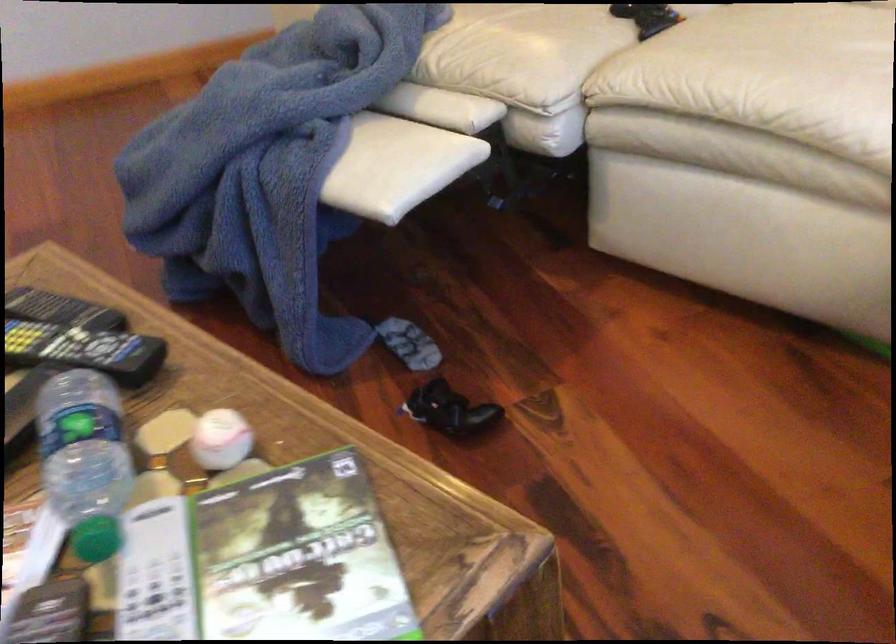
The location [647,17] corresponds to which object?

This point indicates the black game controller.